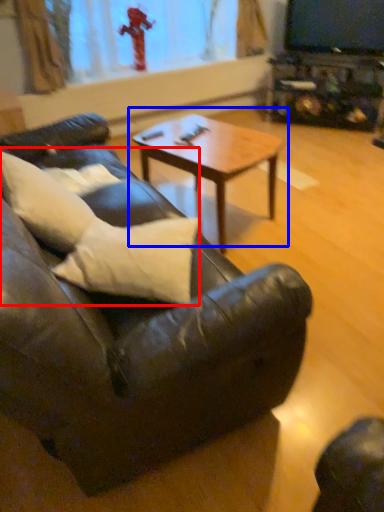
Question: Which of the following is the closest to the observer, pillow (highlighted by a red box) or coffee table (highlighted by a blue box)?

Choices:
 (A) pillow
 (B) coffee table

Answer: (A)